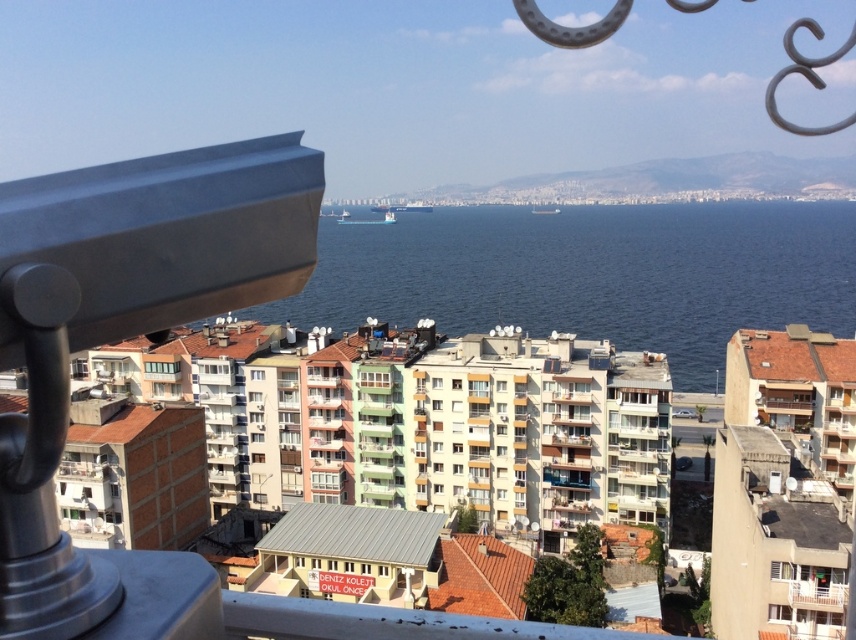
Question: Is metallic gray telescope at left wider than blue water at center?

Choices:
 (A) yes
 (B) no

Answer: (B)

Question: Considering the relative positions of metallic gray telescope at left and blue water at center in the image provided, where is metallic gray telescope at left located with respect to blue water at center?

Choices:
 (A) above
 (B) below

Answer: (B)

Question: Which point is farther to the camera?

Choices:
 (A) metallic gray telescope at left
 (B) blue water at center

Answer: (B)

Question: Which point appears closest to the camera in this image?

Choices:
 (A) (19, 346)
 (B) (742, 259)

Answer: (A)

Question: Is metallic gray telescope at left below blue water at center?

Choices:
 (A) yes
 (B) no

Answer: (A)

Question: Which point is closer to the camera taking this photo?

Choices:
 (A) (88, 582)
 (B) (337, 276)

Answer: (A)